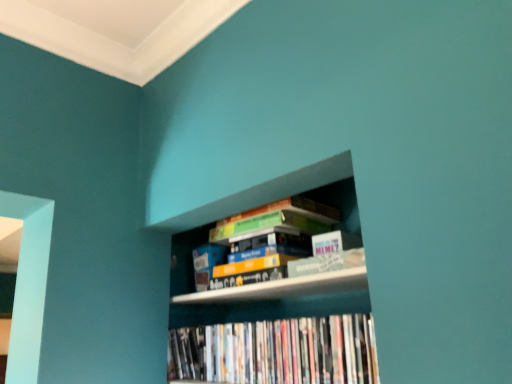
Question: Is wooden bookshelf at center at the right side of white glossy dvds at lower center, which ranks as the first book in bottom-to-top order?

Choices:
 (A) yes
 (B) no

Answer: (A)

Question: Is wooden bookshelf at center in front of white glossy dvds at lower center, which ranks as the first book in bottom-to-top order?

Choices:
 (A) no
 (B) yes

Answer: (B)

Question: Would you consider wooden bookshelf at center to be distant from white glossy dvds at lower center, which ranks as the first book in bottom-to-top order?

Choices:
 (A) yes
 (B) no

Answer: (B)

Question: From the image's perspective, is wooden bookshelf at center under white glossy dvds at lower center, which ranks as the 2th book in top-to-bottom order?

Choices:
 (A) no
 (B) yes

Answer: (A)

Question: Is white glossy dvds at lower center, which ranks as the first book in bottom-to-top order, completely or partially inside wooden bookshelf at center?

Choices:
 (A) yes
 (B) no

Answer: (A)

Question: Is the depth of wooden bookshelf at center greater than that of white glossy dvds at lower center, which ranks as the first book in bottom-to-top order?

Choices:
 (A) no
 (B) yes

Answer: (A)

Question: From a real-world perspective, does hardcover books at upper center, the second book in the bottom-to-top sequence, stand above wooden bookshelf at center?

Choices:
 (A) no
 (B) yes

Answer: (B)

Question: Can we say hardcover books at upper center, the first book in the top-to-bottom sequence, lies outside wooden bookshelf at center?

Choices:
 (A) no
 (B) yes

Answer: (A)

Question: Is hardcover books at upper center, the second book in the bottom-to-top sequence, thinner than wooden bookshelf at center?

Choices:
 (A) yes
 (B) no

Answer: (A)

Question: Does hardcover books at upper center, the first book in the top-to-bottom sequence, contain wooden bookshelf at center?

Choices:
 (A) yes
 (B) no

Answer: (B)

Question: Can you confirm if hardcover books at upper center, the second book in the bottom-to-top sequence, is taller than wooden bookshelf at center?

Choices:
 (A) no
 (B) yes

Answer: (A)

Question: From a real-world perspective, is hardcover books at upper center, the second book in the bottom-to-top sequence, physically below wooden bookshelf at center?

Choices:
 (A) no
 (B) yes

Answer: (A)

Question: Is hardcover books at upper center, the second book in the bottom-to-top sequence, wider than white glossy dvds at lower center, which ranks as the first book in bottom-to-top order?

Choices:
 (A) yes
 (B) no

Answer: (A)